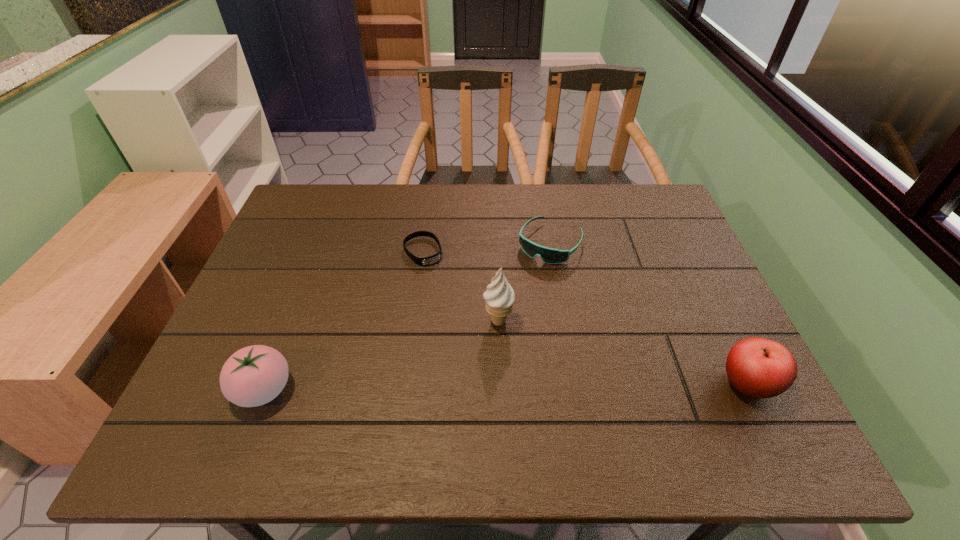
The height and width of the screenshot is (540, 960). Find the location of `vacant space located 0.090m on the front-facing side of the second object from right to left`. vacant space located 0.090m on the front-facing side of the second object from right to left is located at coordinates (523, 284).

At what (x,y) coordinates should I click in order to perform the action: click on vacant region located 0.310m on the front-facing side of the second object from right to left. Please return your answer as a coordinate pair (x, y). This screenshot has width=960, height=540. Looking at the image, I should click on (483, 343).

Identify the location of free region located on the front-facing side of the second object from right to left. The height and width of the screenshot is (540, 960). (510, 303).

Find the location of `free region located on the display of the wristband`. free region located on the display of the wristband is located at coordinates (476, 335).

Locate an element on the screen. The image size is (960, 540). free space located 0.220m on the display of the wristband is located at coordinates tap(467, 320).

Locate an element on the screen. Image resolution: width=960 pixels, height=540 pixels. free region located 0.060m on the display of the wristband is located at coordinates (440, 279).

Identify the location of vacant space located on the front-facing side of the icecream. (521, 345).

This screenshot has height=540, width=960. Identify the location of vacant area located 0.190m on the front-facing side of the icecream. (564, 388).

At what (x,y) coordinates should I click in order to perform the action: click on free location located 0.070m on the front-facing side of the icecream. Please return your answer as a coordinate pair (x, y). The image size is (960, 540). Looking at the image, I should click on (527, 350).

Where is `object that is positioned at the far edge`? object that is positioned at the far edge is located at coordinates (548, 255).